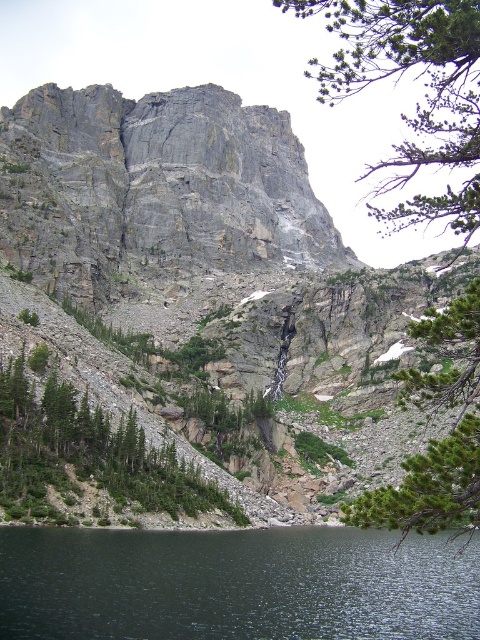
Image resolution: width=480 pixels, height=640 pixels. Describe the element at coordinates (407, 70) in the screenshot. I see `green leafy tree at center` at that location.

Is green leafy tree at center shorter than green rough rock at center?

No.

You are a GUI agent. You are given a task and a screenshot of the screen. Output one action in this format:
    pyautogui.click(x=<x>, y=<y>)
    Task: Click on the green leafy tree at center
    The height and width of the screenshot is (640, 480).
    Given the screenshot: What is the action you would take?
    pyautogui.click(x=407, y=70)

Locate an element on the screen. The width and height of the screenshot is (480, 640). dark reflective water at lower center is located at coordinates (236, 584).

Between point (131, 602) and point (66, 452), which one is positioned behind?

Point (66, 452)

The height and width of the screenshot is (640, 480). Identify the location of dark reflective water at lower center. (236, 584).

Is gray rock mountain at upper center to the left of green leafy tree at upper center from the viewer's perspective?

Yes, gray rock mountain at upper center is to the left of green leafy tree at upper center.

Who is lower down, gray rock mountain at upper center or green leafy tree at upper center?

Positioned lower is gray rock mountain at upper center.

Is point (361, 502) in front of point (371, 195)?

Yes, point (361, 502) is closer to viewer.

Identify the location of gray rock mountain at upper center. This screenshot has height=640, width=480. point(191,273).